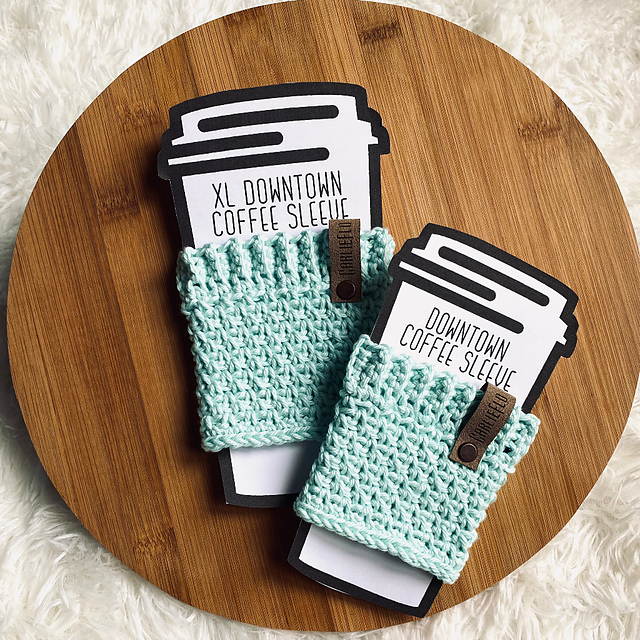
Where is `coffee cups`? This screenshot has height=640, width=640. coffee cups is located at coordinates (251, 100), (520, 305).